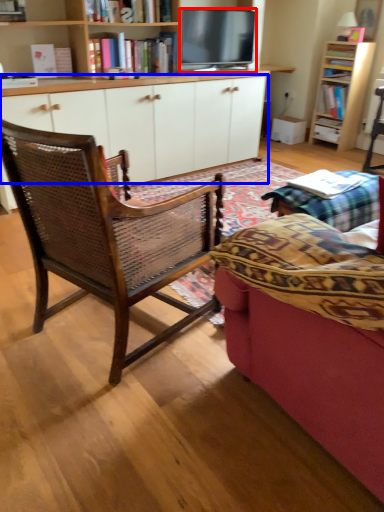
Question: Which object appears closest to the camera in this image, television (highlighted by a red box) or cabinetry (highlighted by a blue box)?

Choices:
 (A) television
 (B) cabinetry

Answer: (B)